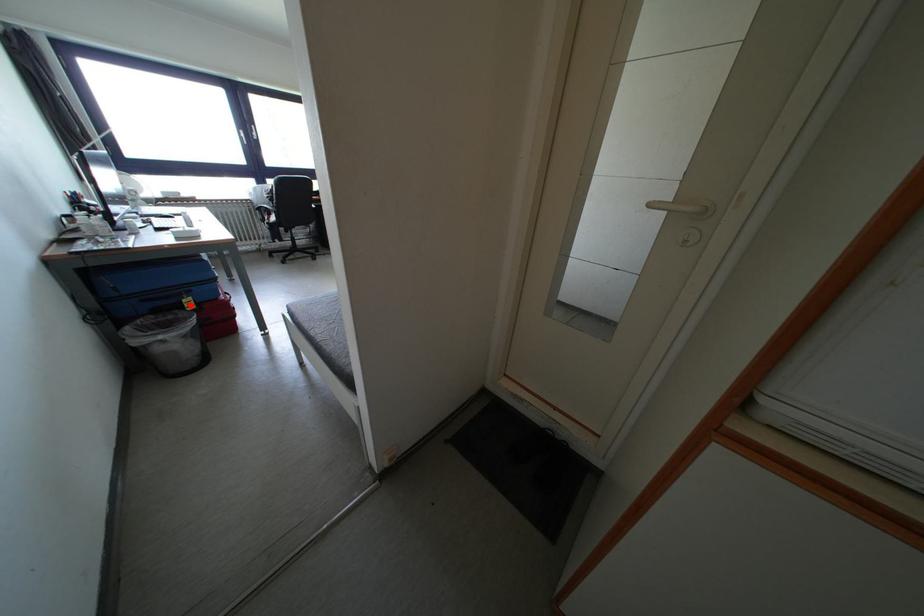
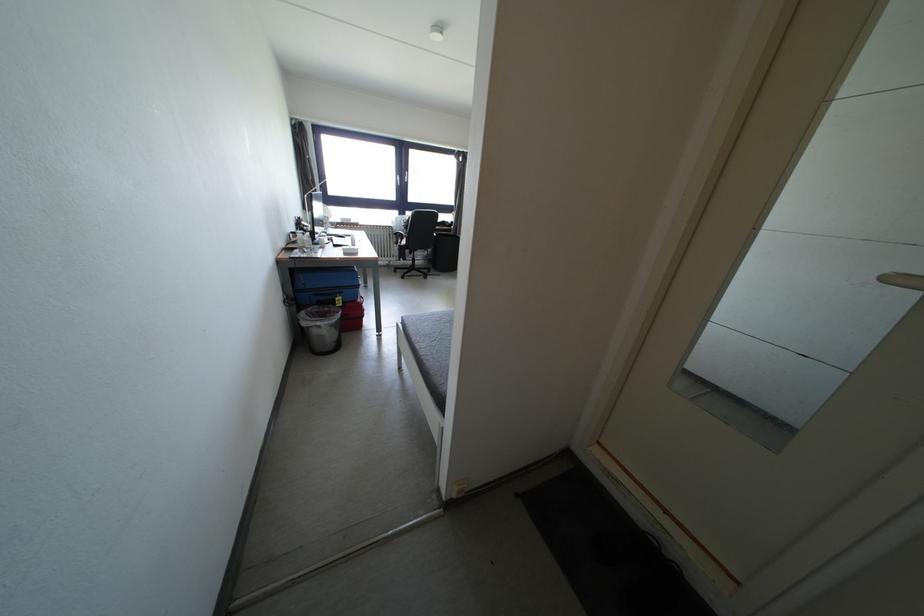
In the second image, find the point that corresponds to the highlighted location in the first image.

(344, 302)